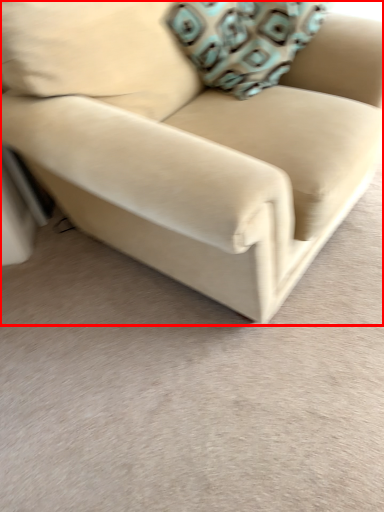
Question: From the image's perspective, where is studio couch (annotated by the red box) located relative to throw pillow?

Choices:
 (A) below
 (B) above

Answer: (A)